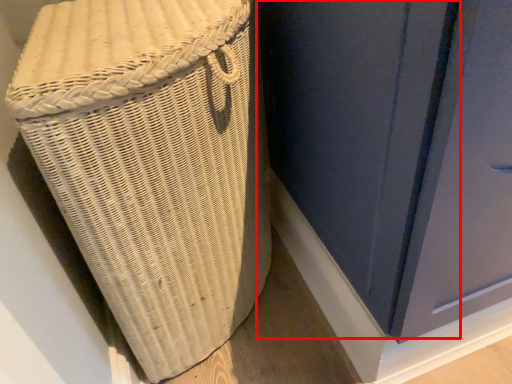
Question: From the image's perspective, where is screen door (annotated by the red box) located in relation to furniture in the image?

Choices:
 (A) below
 (B) above

Answer: (B)